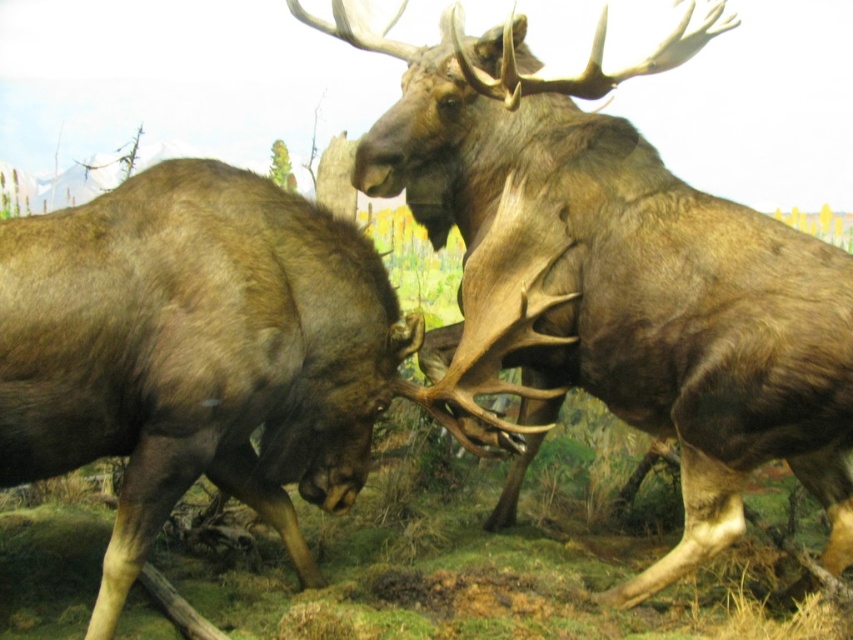
Between point (538, 220) and point (293, 314), which one is positioned in front?

Point (293, 314)

Which is more to the right, brown furry moose at center or brown velvet moose at center?

Positioned to the right is brown furry moose at center.

The image size is (853, 640). I want to click on brown furry moose at center, so click(x=614, y=280).